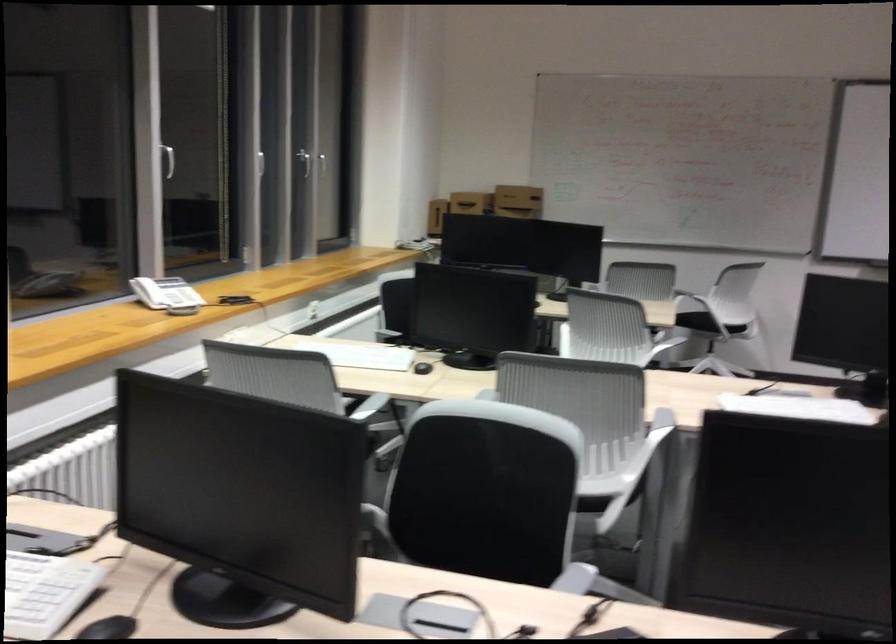
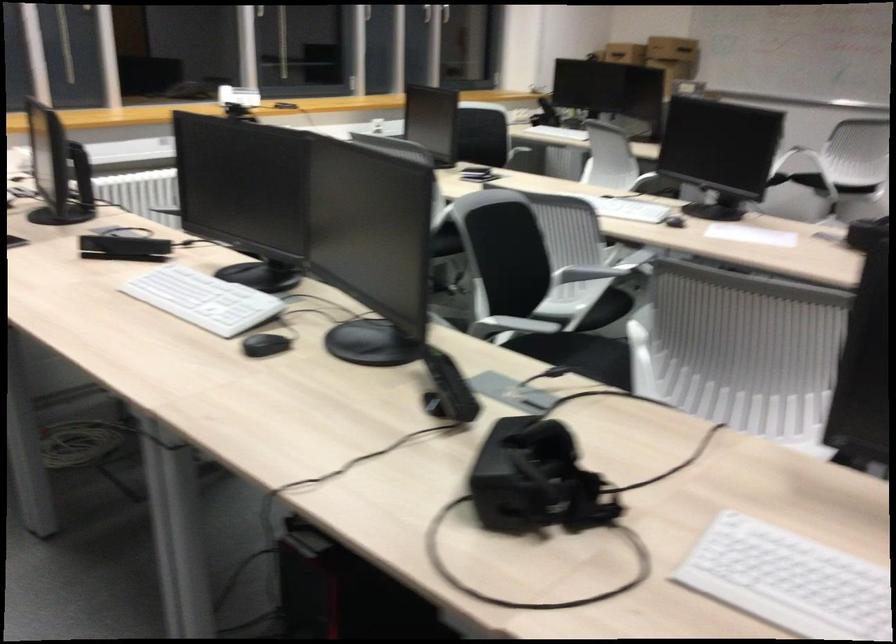
Where in the second image is the point corresponding to (x=151, y=283) from the first image?

(238, 96)